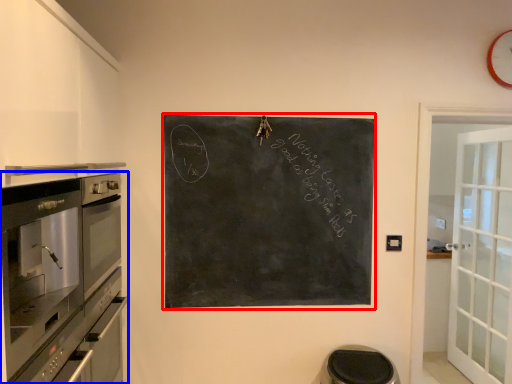
Question: Which point is further to the camera, bulletin board (highlighted by a red box) or home appliance (highlighted by a blue box)?

Choices:
 (A) bulletin board
 (B) home appliance

Answer: (A)